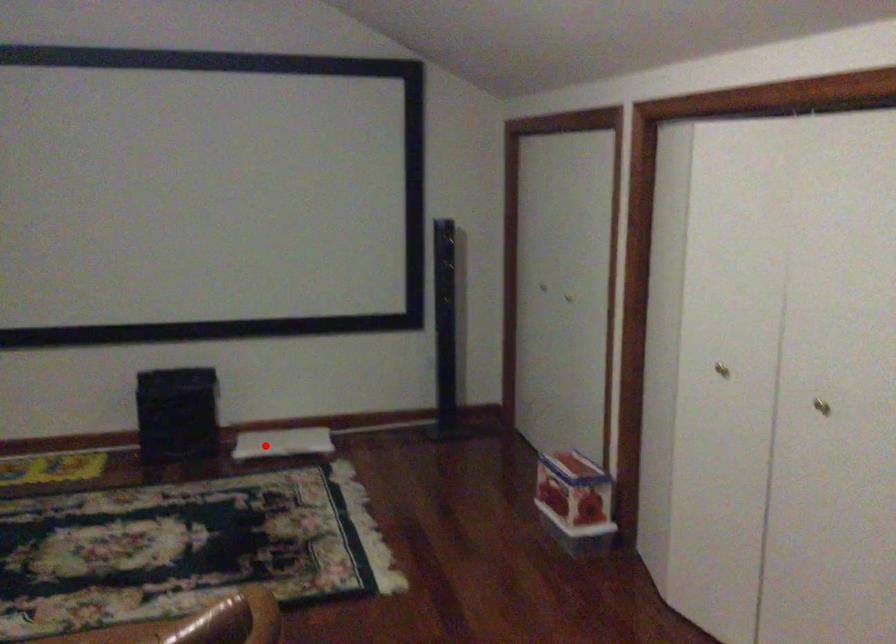
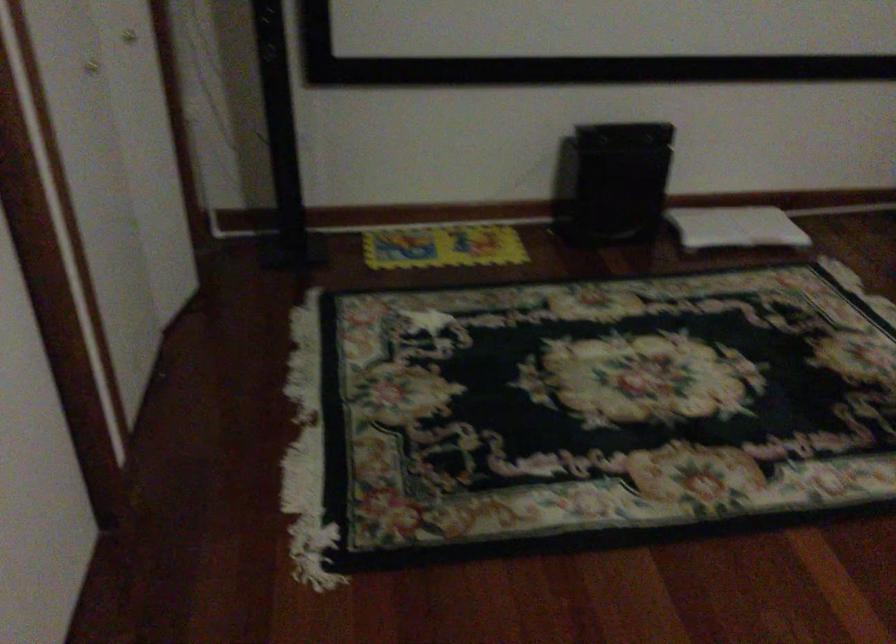
Question: I am providing you with two images of the same scene from different viewpoints. Given a red point in image1, look at the same physical point in image2. Is it:

Choices:
 (A) Closer to the viewpoint
 (B) Farther from the viewpoint

Answer: (A)